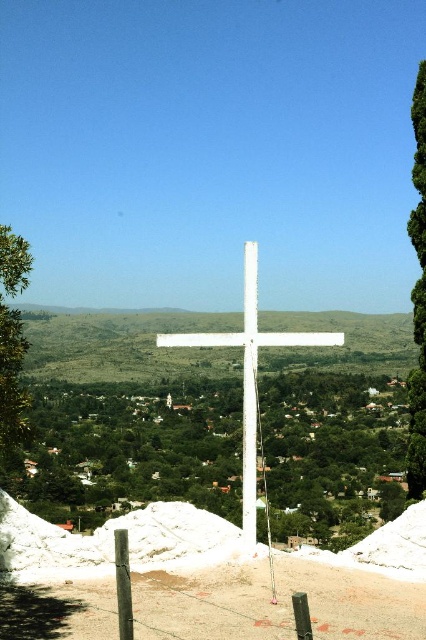
You are a photographer planning to capture the white matte cross at center and the green leafy tree at center in a single frame. Based on their heights, which object will appear taller in your photo?

The white matte cross at center appears taller than the green leafy tree at center in the photo because the description states that the green leafy tree at center has a lesser height compared to the white matte cross at center.

You are standing at the base of the large white cross in the foreground of the image. You notice a point marked at coordinates (131, 451). Based on the scene, can you determine what object this point corresponds to?

The point at (131, 451) is on the green leafy tree at center.